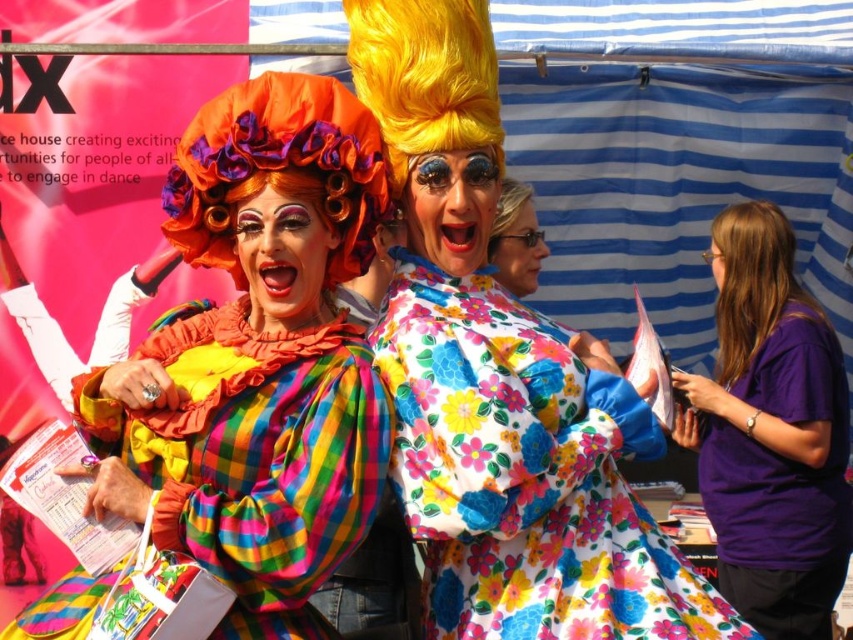
You are a photographer trying to capture the best shot of the multicolored plaid dress at center. Considering the stage layout, where should you position yourself to ensure the dress is in the frame?

To capture the multicolored plaid dress at center, position yourself facing the center of the stage since the dress is located at point (254, 458), which is near the central area.

Based on the photo, you are standing in front of the two performers. The floral fabric dress at center is located at point (525, 474). Can you tell me which performer is wearing the floral fabric dress at center?

The floral fabric dress at center is located at point (525, 474), which corresponds to the individual on the right wearing the white dress covered with a floral pattern in shades of pink, blue, and yellow.